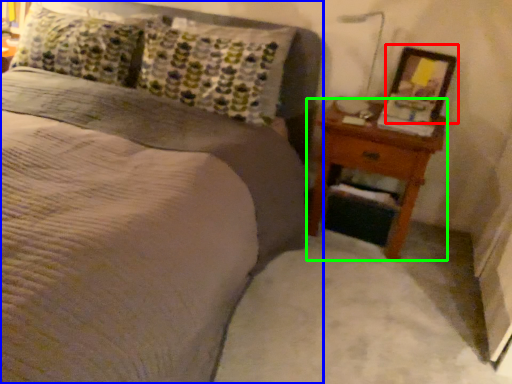
Question: Based on their relative distances, which object is nearer to picture frame (highlighted by a red box)? Choose from bed (highlighted by a blue box) and nightstand (highlighted by a green box).

Choices:
 (A) bed
 (B) nightstand

Answer: (B)